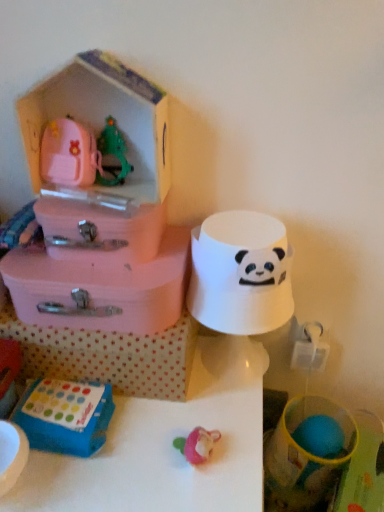
I want to click on free spot above pink plastic suitcase at left, the 2th storage box ordered from the bottom (from a real-world perspective), so click(99, 254).